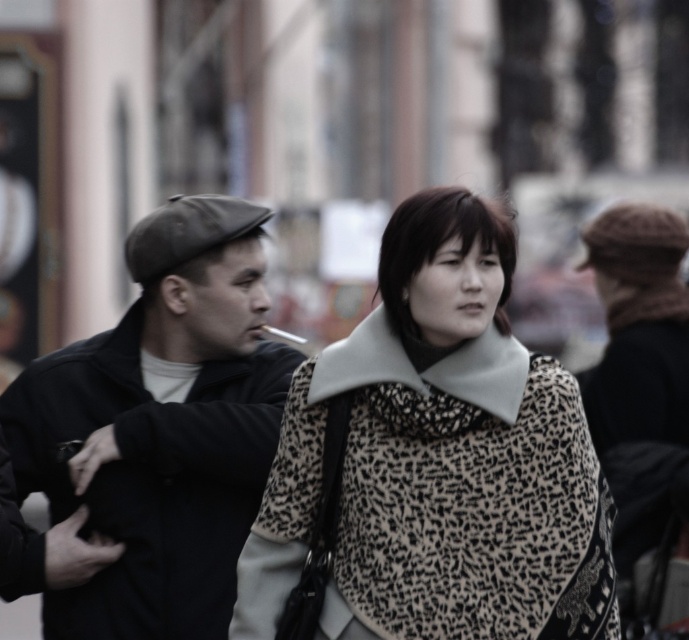
Is leopard print scarf at center smaller than matte black jacket at left?

Yes.

Is point (331, 412) positioned behind point (119, 388)?

No, (331, 412) is closer to viewer.

Identify the location of leopard print scarf at center. Image resolution: width=689 pixels, height=640 pixels. (433, 461).